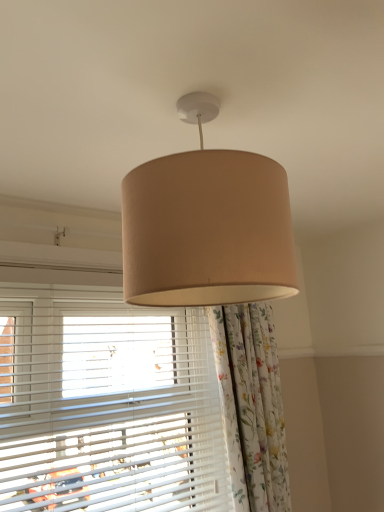
Describe the element at coordinates (206, 225) in the screenshot. The height and width of the screenshot is (512, 384). I see `beige fabric lampshade at center` at that location.

Find the location of `beige fabric lampshade at center`. beige fabric lampshade at center is located at coordinates (206, 225).

What is the approximate width of white matte blinds at lower left?

It is 6.19 inches.

This screenshot has width=384, height=512. In order to click on white matte blinds at lower left in this screenshot , I will do `click(105, 399)`.

In order to face white matte blinds at lower left, should I rotate leftwards or rightwards?

Rotate your view left by about 8.305°.

What do you see at coordinates (105, 399) in the screenshot? Image resolution: width=384 pixels, height=512 pixels. I see `white matte blinds at lower left` at bounding box center [105, 399].

Where is `beige fabric lampshade at center`? The image size is (384, 512). beige fabric lampshade at center is located at coordinates (206, 225).

In the scene shown: Is white matte blinds at lower left at the left side of beige fabric lampshade at center?

Indeed, white matte blinds at lower left is positioned on the left side of beige fabric lampshade at center.

Which object is closer to the camera taking this photo, white matte blinds at lower left or beige fabric lampshade at center?

beige fabric lampshade at center.

Is point (163, 423) less distant than point (219, 185)?

No, (163, 423) is further to viewer.

From the image's perspective, is white matte blinds at lower left located above or below beige fabric lampshade at center?

From the image's perspective, white matte blinds at lower left appears below beige fabric lampshade at center.

From a real-world perspective, is white matte blinds at lower left below beige fabric lampshade at center?

Yes, from a real-world perspective, white matte blinds at lower left is under beige fabric lampshade at center.

Does white matte blinds at lower left have a lesser width compared to beige fabric lampshade at center?

Yes.

Which of these two, white matte blinds at lower left or beige fabric lampshade at center, stands shorter?

With less height is beige fabric lampshade at center.

Does white matte blinds at lower left have a larger size compared to beige fabric lampshade at center?

Indeed, white matte blinds at lower left has a larger size compared to beige fabric lampshade at center.

Is white matte blinds at lower left outside of beige fabric lampshade at center?

Yes.

Is white matte blinds at lower left touching beige fabric lampshade at center?

No, white matte blinds at lower left is not with beige fabric lampshade at center.

Is white matte blinds at lower left facing towards beige fabric lampshade at center?

Yes, white matte blinds at lower left is turned towards beige fabric lampshade at center.

In order to click on window that is below the beige fabric lampshade at center (from the image's perspective) in this screenshot , I will do `click(105, 399)`.

Is beige fabric lampshade at center at the left side of white matte blinds at lower left?

In fact, beige fabric lampshade at center is to the right of white matte blinds at lower left.

Considering the relative positions of beige fabric lampshade at center and white matte blinds at lower left in the image provided, is beige fabric lampshade at center in front of white matte blinds at lower left?

Yes, it is in front of white matte blinds at lower left.

Which point is more forward, (258, 294) or (16, 469)?

The point (258, 294) is closer to the camera.

From the image's perspective, which object appears higher, beige fabric lampshade at center or white matte blinds at lower left?

beige fabric lampshade at center is shown above in the image.

From a real-world perspective, between beige fabric lampshade at center and white matte blinds at lower left, who is vertically lower?

white matte blinds at lower left.

Between beige fabric lampshade at center and white matte blinds at lower left, which one has larger width?

Wider between the two is beige fabric lampshade at center.

Considering the relative sizes of beige fabric lampshade at center and white matte blinds at lower left in the image provided, is beige fabric lampshade at center taller than white matte blinds at lower left?

In fact, beige fabric lampshade at center may be shorter than white matte blinds at lower left.

Who is smaller, beige fabric lampshade at center or white matte blinds at lower left?

beige fabric lampshade at center.

Is beige fabric lampshade at center situated inside white matte blinds at lower left or outside?

beige fabric lampshade at center is located beyond the bounds of white matte blinds at lower left.

Is there a large distance between beige fabric lampshade at center and white matte blinds at lower left?

That's not correct — beige fabric lampshade at center is a little close to white matte blinds at lower left.

Is beige fabric lampshade at center facing away from white matte blinds at lower left?

Absolutely, beige fabric lampshade at center is directed away from white matte blinds at lower left.

What's the angular difference between beige fabric lampshade at center and white matte blinds at lower left's facing directions?

0.0468 degrees separate the facing orientations of beige fabric lampshade at center and white matte blinds at lower left.

You are a GUI agent. You are given a task and a screenshot of the screen. Output one action in this format:
    pyautogui.click(x=<x>, y=<y>)
    Task: Click on the window behind the beige fabric lampshade at center
    
    Given the screenshot: What is the action you would take?
    pyautogui.click(x=105, y=399)

Identify the location of window below the beige fabric lampshade at center (from the image's perspective). Image resolution: width=384 pixels, height=512 pixels. (105, 399).

Find the location of `lamp on the right of white matte blinds at lower left`. lamp on the right of white matte blinds at lower left is located at coordinates (206, 225).